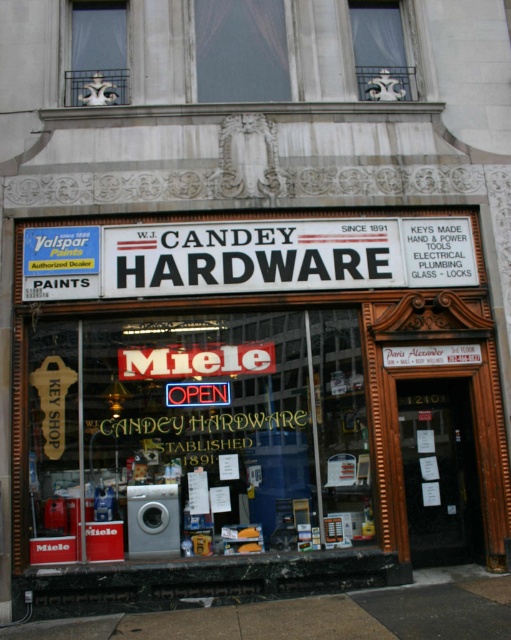
Is transparent glass window at center to the right of white/black sign at center from the viewer's perspective?

No, transparent glass window at center is not to the right of white/black sign at center.

Who is positioned more to the left, transparent glass window at center or white/black sign at center?

Positioned to the left is transparent glass window at center.

Is point (196, 344) less distant than point (108, 292)?

No, (196, 344) is further to viewer.

The width and height of the screenshot is (511, 640). I want to click on transparent glass window at center, so click(x=197, y=435).